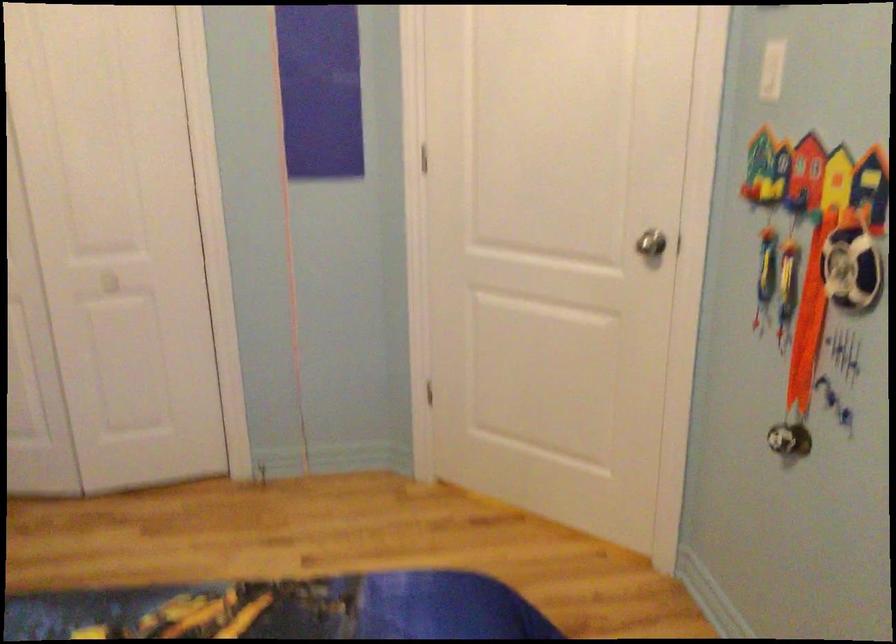
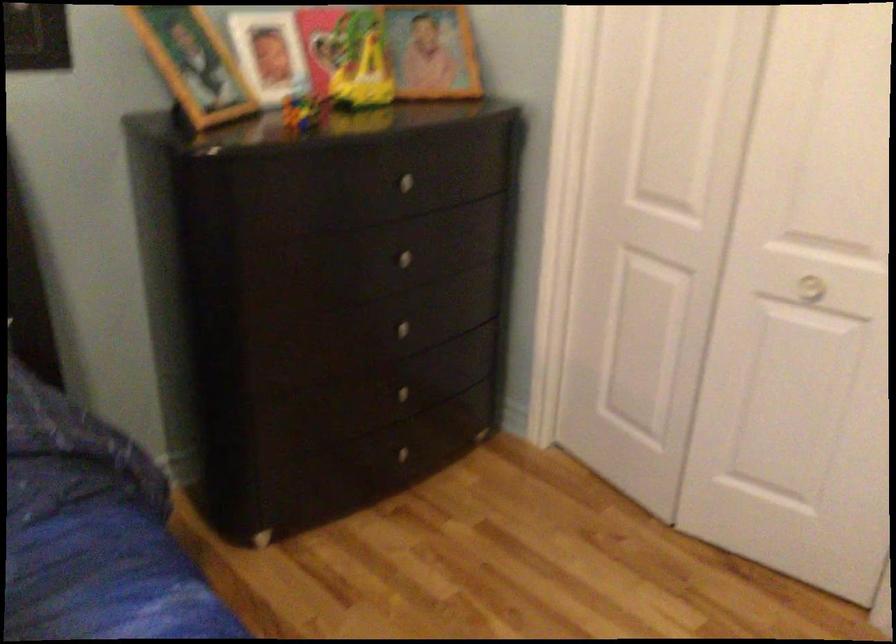
Locate, in the second image, the point that corresponds to (99,283) in the first image.

(810, 288)